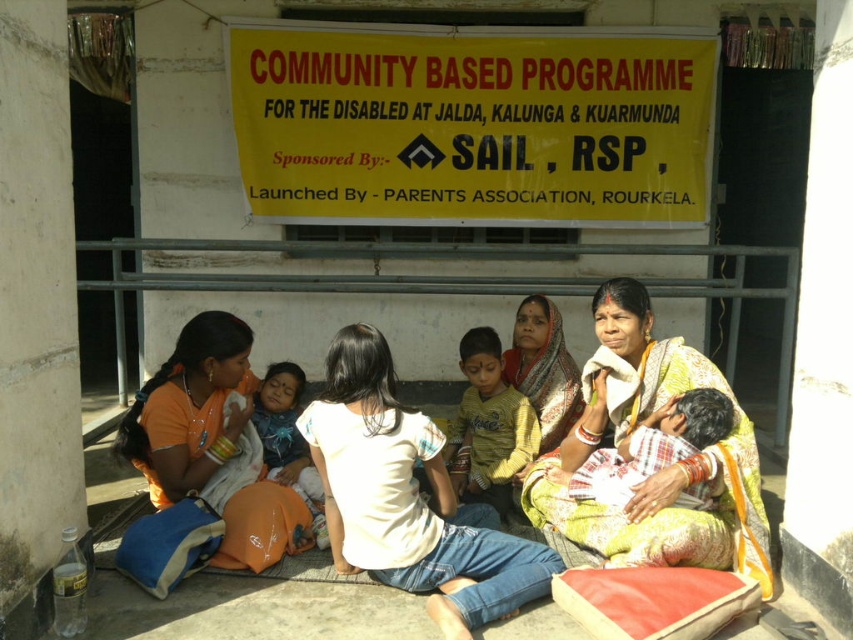
Question: Which object is the farthest from the printed fabric shawl at center?

Choices:
 (A) orange fabric at lower left
 (B) yellow printed sari at center
 (C) white cotton saree at center

Answer: (A)

Question: Can you confirm if orange fabric at lower left is positioned to the left of printed fabric shawl at center?

Choices:
 (A) yes
 (B) no

Answer: (A)

Question: Does yellow cotton shirt at center have a larger size compared to white cotton shirt at center?

Choices:
 (A) yes
 (B) no

Answer: (A)

Question: Among these points, which one is nearest to the camera?

Choices:
 (A) (239, 376)
 (B) (596, 552)
 (C) (498, 474)
 (D) (294, 51)

Answer: (B)

Question: From the image, what is the correct spatial relationship of orange fabric at lower left in relation to printed fabric shawl at center?

Choices:
 (A) right
 (B) left

Answer: (B)

Question: Which point is farther from the camera taking this photo?

Choices:
 (A) (693, 456)
 (B) (537, 429)
 (C) (526, 579)

Answer: (B)